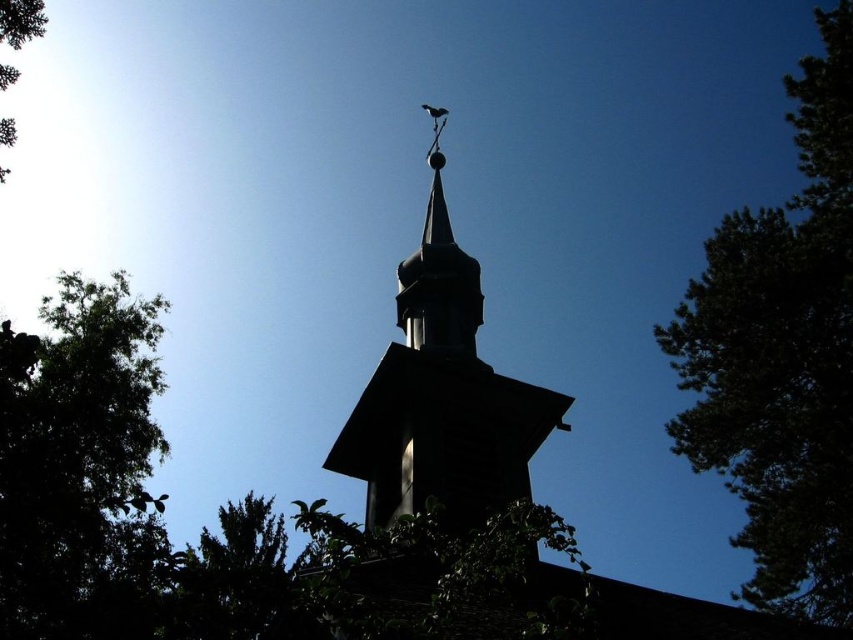
Question: Among these objects, which one is nearest to the camera?

Choices:
 (A) green leafy tree at lower left
 (B) green leafy tree at upper left
 (C) black wood steeple at center
 (D) green leafy tree at upper right

Answer: (A)

Question: Does green leafy tree at lower left appear on the right side of black wood steeple at center?

Choices:
 (A) yes
 (B) no

Answer: (B)

Question: Observing the image, what is the correct spatial positioning of green leafy tree at upper right in reference to green leafy tree at upper left?

Choices:
 (A) below
 (B) above

Answer: (A)

Question: Which of the following is the closest to the observer?

Choices:
 (A) (374, 385)
 (B) (135, 369)
 (C) (13, 70)
 (D) (840, 68)

Answer: (A)

Question: Does green leafy tree at lower left appear on the left side of green leafy tree at upper left?

Choices:
 (A) yes
 (B) no

Answer: (B)

Question: Which of the following is the closest to the observer?

Choices:
 (A) green leafy tree at upper left
 (B) green leafy tree at upper right
 (C) green leafy tree at lower left
 (D) black wood steeple at center

Answer: (C)